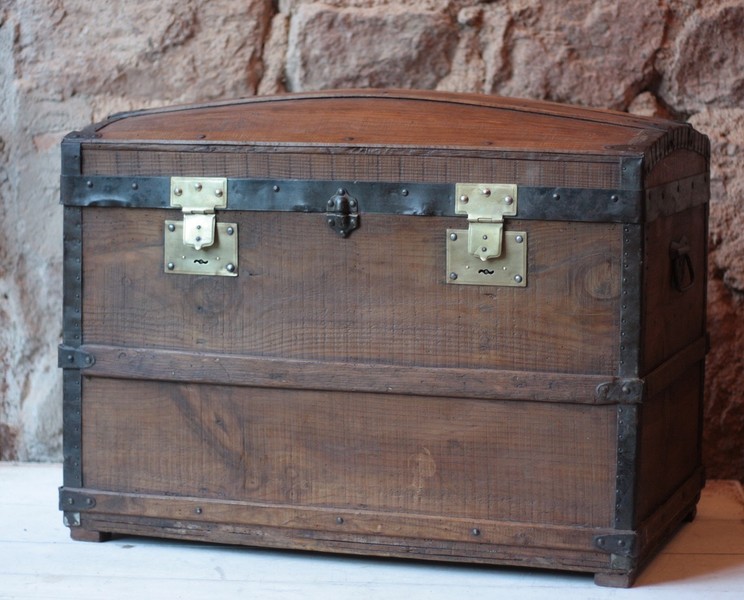
Locate an element on the screen. chest lid is located at coordinates (356, 127).